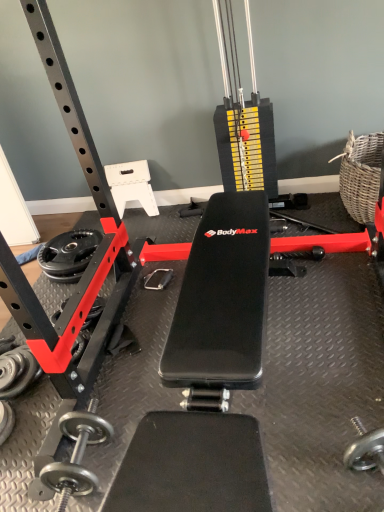
Where is `vacant space to the right of black rubber weight plate at lower left`? The image size is (384, 512). vacant space to the right of black rubber weight plate at lower left is located at coordinates (148, 242).